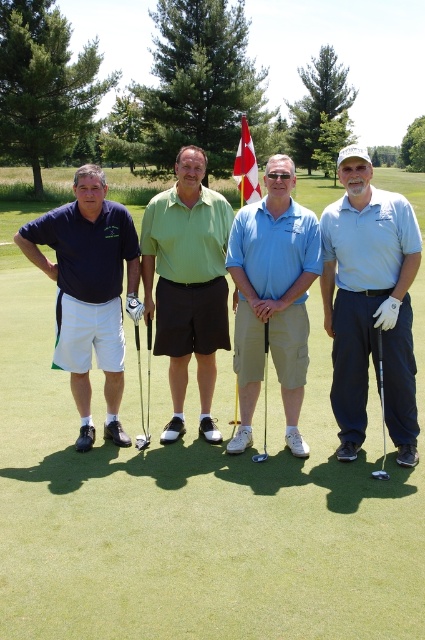
Question: Which of these objects is positioned farthest from the green matte shirt at center?

Choices:
 (A) metallic silver golf club at center
 (B) black rubber golf club at right
 (C) green grass at center
 (D) glossy metallic golf club at center

Answer: (C)

Question: Is green matte shirt at center smaller than black rubber golf club at right?

Choices:
 (A) yes
 (B) no

Answer: (A)

Question: Considering the real-world distances, which object is closest to the black rubber golf club at center?

Choices:
 (A) metallic silver golf club at center
 (B) light blue cotton polo shirt at right
 (C) black rubber golf club at right

Answer: (A)

Question: Estimate the real-world distances between objects in this image. Which object is farther from the metallic silver golf club at center?

Choices:
 (A) black rubber golf club at right
 (B) green grass at center
 (C) black rubber golf club at center

Answer: (B)

Question: Considering the relative positions of red/white fabric flag at center and glossy metallic golf club at center in the image provided, where is red/white fabric flag at center located with respect to glossy metallic golf club at center?

Choices:
 (A) left
 (B) right

Answer: (B)

Question: Is blue cotton polo shirt at center positioned behind black rubber golf club at center?

Choices:
 (A) no
 (B) yes

Answer: (A)